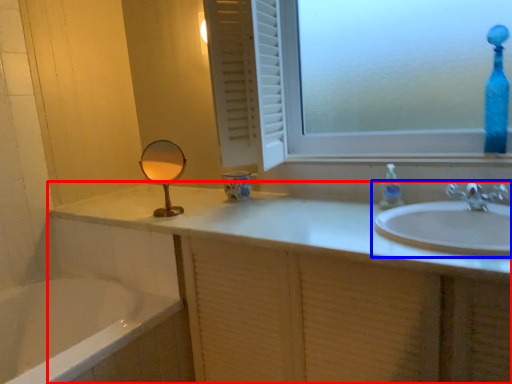
Question: Which point is further to the camera, bathroom cabinet (highlighted by a red box) or sink (highlighted by a blue box)?

Choices:
 (A) bathroom cabinet
 (B) sink

Answer: (B)